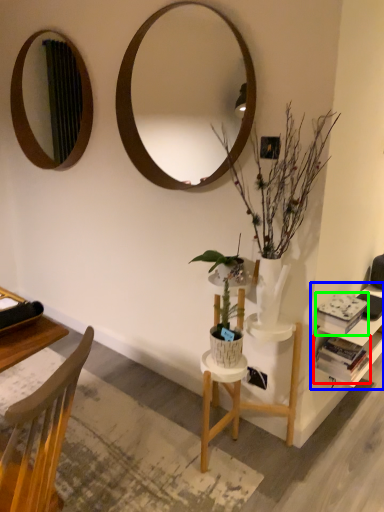
Question: Based on their relative distances, which object is nearer to book (highlighted by a red box)? Choose from shelf (highlighted by a blue box) and book (highlighted by a green box).

Choices:
 (A) shelf
 (B) book

Answer: (A)